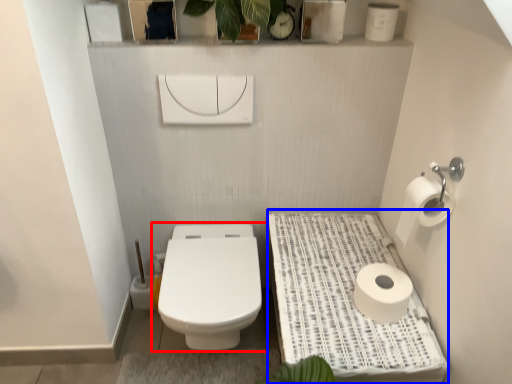
Question: Among these objects, which one is nearest to the camera, toilet (highlighted by a red box) or table (highlighted by a blue box)?

Choices:
 (A) toilet
 (B) table

Answer: (B)